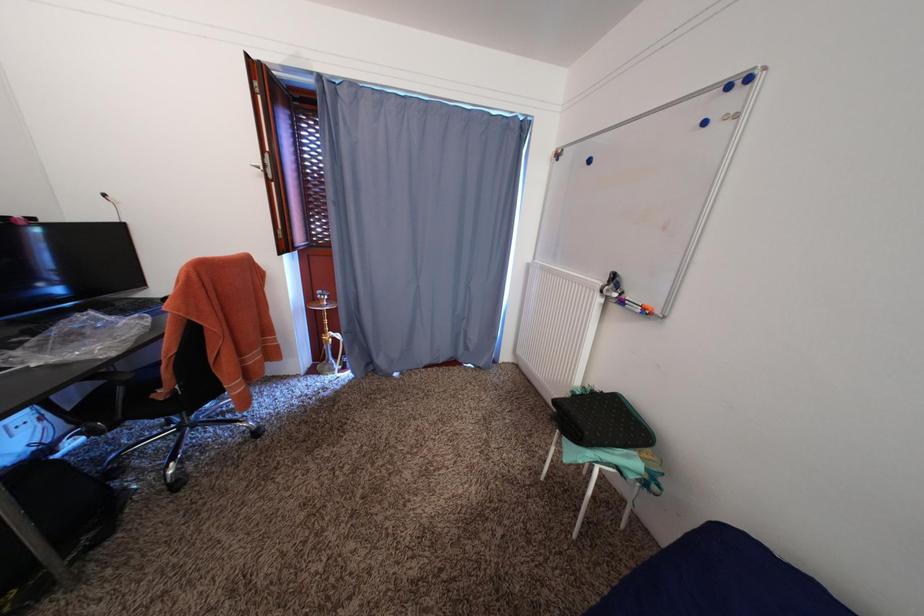
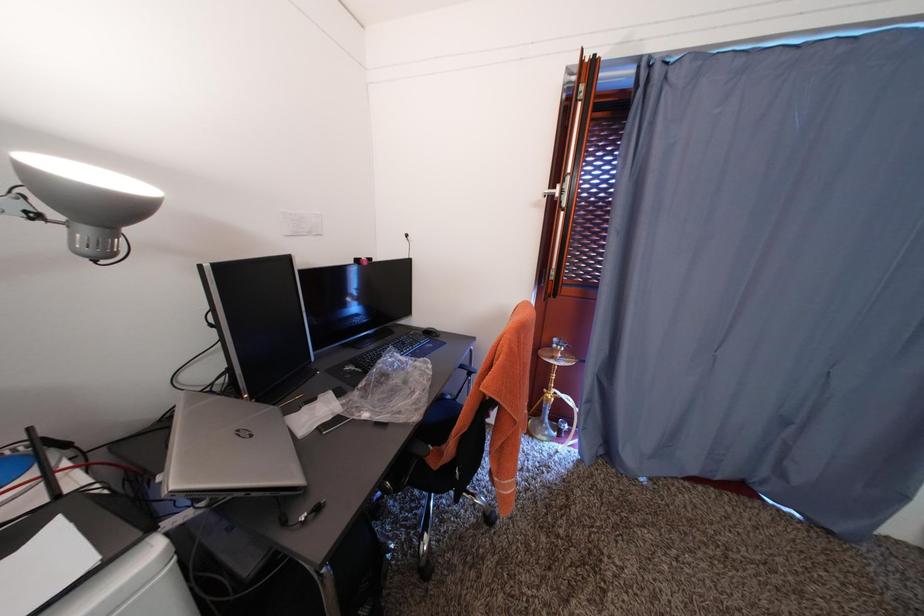
Question: How did the camera likely rotate?

Choices:
 (A) Left
 (B) Right
 (C) Up
 (D) Down

Answer: (A)